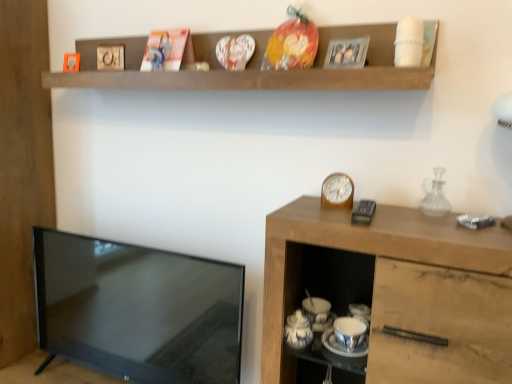
Where is `vacant region to the left of wooden clock at right`? This screenshot has width=512, height=384. vacant region to the left of wooden clock at right is located at coordinates (297, 212).